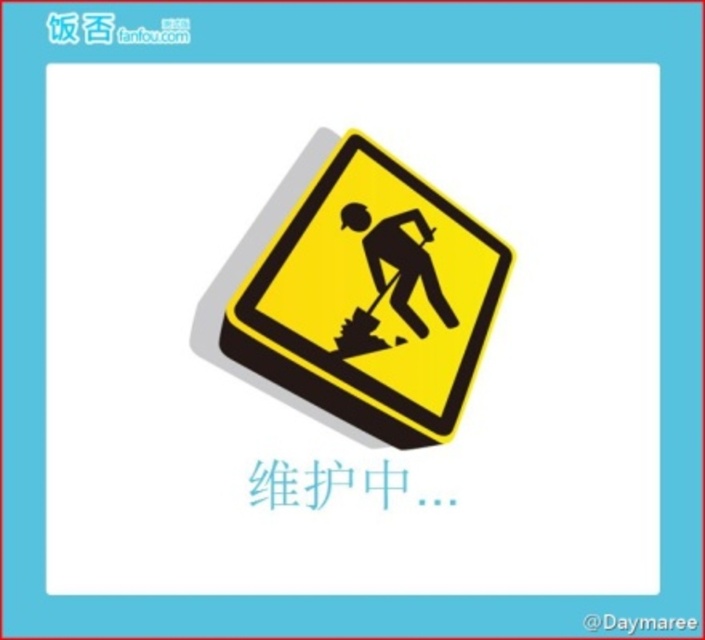
Question: Which point appears farthest from the camera in this image?

Choices:
 (A) (369, 259)
 (B) (381, 246)

Answer: (B)

Question: Can you confirm if yellow matte sign at center is bigger than black silhouette man at center?

Choices:
 (A) no
 (B) yes

Answer: (B)

Question: Is yellow matte sign at center to the right of black silhouette man at center from the viewer's perspective?

Choices:
 (A) no
 (B) yes

Answer: (A)

Question: Which point is closer to the camera?

Choices:
 (A) (410, 268)
 (B) (398, 195)

Answer: (A)

Question: Is yellow matte sign at center above black silhouette man at center?

Choices:
 (A) no
 (B) yes

Answer: (A)

Question: Which of the following is the closest to the observer?

Choices:
 (A) yellow matte sign at center
 (B) black silhouette man at center

Answer: (A)